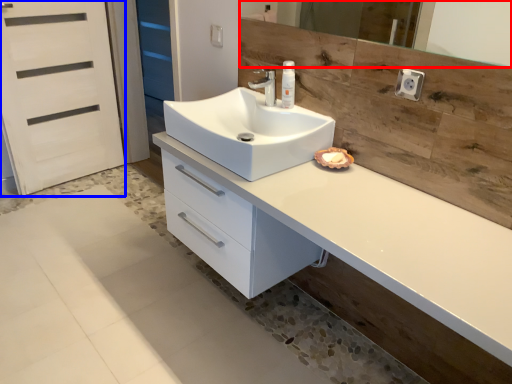
Question: Which object appears farthest to the camera in this image, mirror (highlighted by a red box) or screen door (highlighted by a blue box)?

Choices:
 (A) mirror
 (B) screen door

Answer: (B)